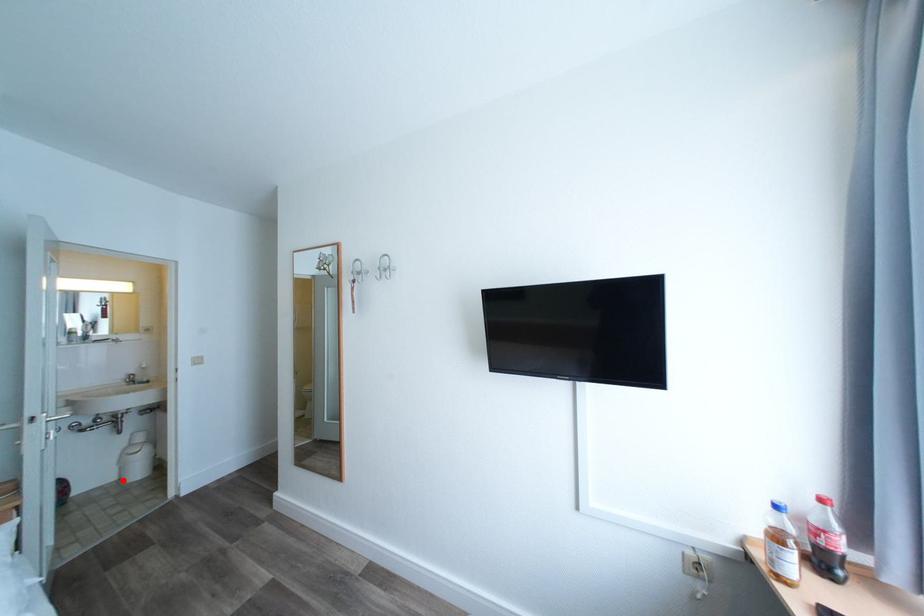
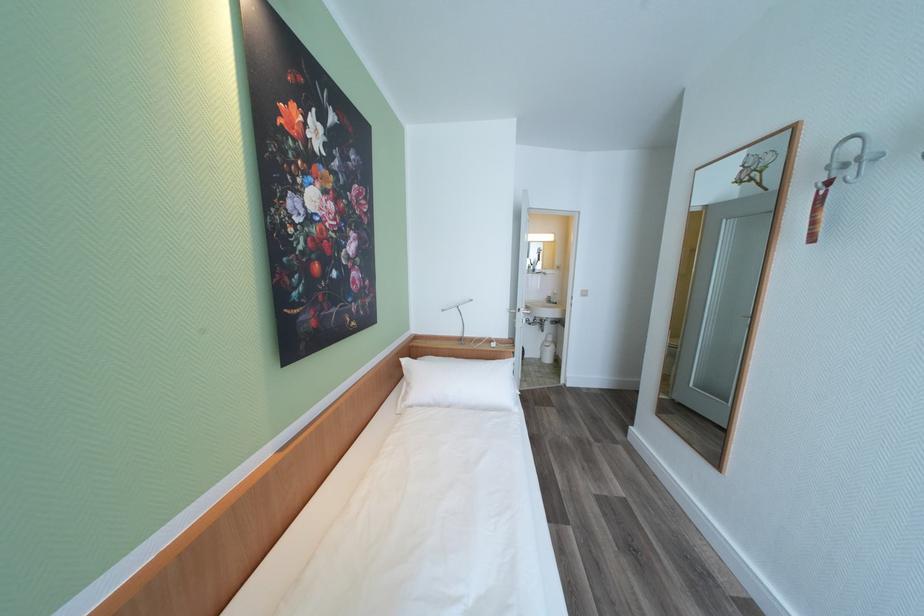
The point at the highlighted location is marked in the first image. Where is the corresponding point in the second image?

(546, 359)